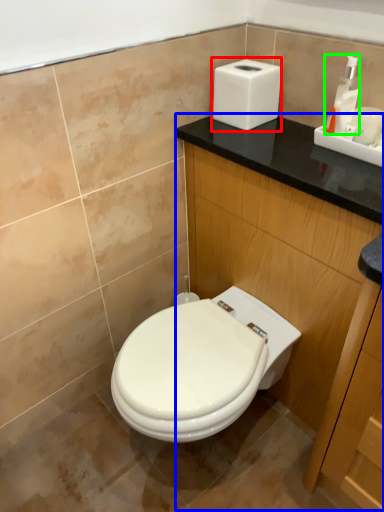
Question: Which object is the farthest from hand dryer (highlighted by a red box)? Choose among these: dresser (highlighted by a blue box) or soap dispenser (highlighted by a green box).

Choices:
 (A) dresser
 (B) soap dispenser

Answer: (A)